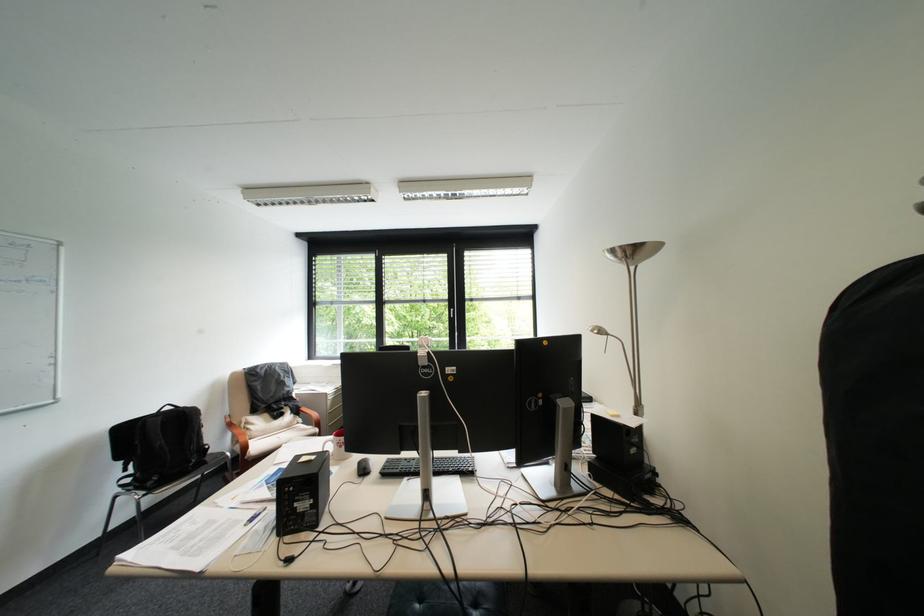
Image resolution: width=924 pixels, height=616 pixels. Find the location of `wooden chair armrest`. wooden chair armrest is located at coordinates (236, 430).